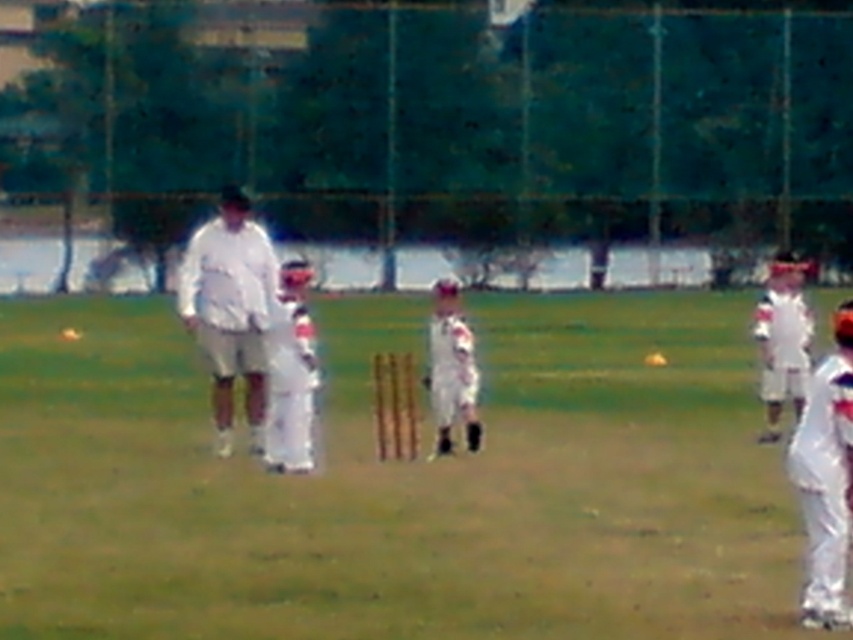
Does white matte cricket bat at center appear over white fabric baseball uniform at center?

Indeed, white matte cricket bat at center is positioned over white fabric baseball uniform at center.

Is white matte cricket bat at center thinner than white fabric baseball uniform at center?

No.

Locate an element on the screen. The width and height of the screenshot is (853, 640). white matte cricket bat at center is located at coordinates (230, 308).

At what (x,y) coordinates should I click in order to perform the action: click on white matte cricket bat at center. Please return your answer as a coordinate pair (x, y). The image size is (853, 640). Looking at the image, I should click on (230, 308).

Does white matte cricket bat at center appear on the right side of white fabric uniform at right?

Incorrect, white matte cricket bat at center is not on the right side of white fabric uniform at right.

Who is more forward, (263, 385) or (786, 388)?

Point (263, 385) is in front.

This screenshot has height=640, width=853. Describe the element at coordinates (230, 308) in the screenshot. I see `white matte cricket bat at center` at that location.

At what (x,y) coordinates should I click in order to perform the action: click on white matte cricket bat at center. Please return your answer as a coordinate pair (x, y). Image resolution: width=853 pixels, height=640 pixels. Looking at the image, I should click on tap(230, 308).

Who is higher up, white fabric cricket bat at center or white matte baseball uniform at center?

Positioned higher is white matte baseball uniform at center.

Describe the element at coordinates (399, 483) in the screenshot. I see `white fabric cricket bat at center` at that location.

Which is in front, point (770, 524) or point (469, 397)?

Positioned in front is point (770, 524).

You are a GUI agent. You are given a task and a screenshot of the screen. Output one action in this format:
    pyautogui.click(x=<x>, y=<y>)
    Task: Click on the white fabric cricket bat at center
    
    Given the screenshot: What is the action you would take?
    pyautogui.click(x=399, y=483)